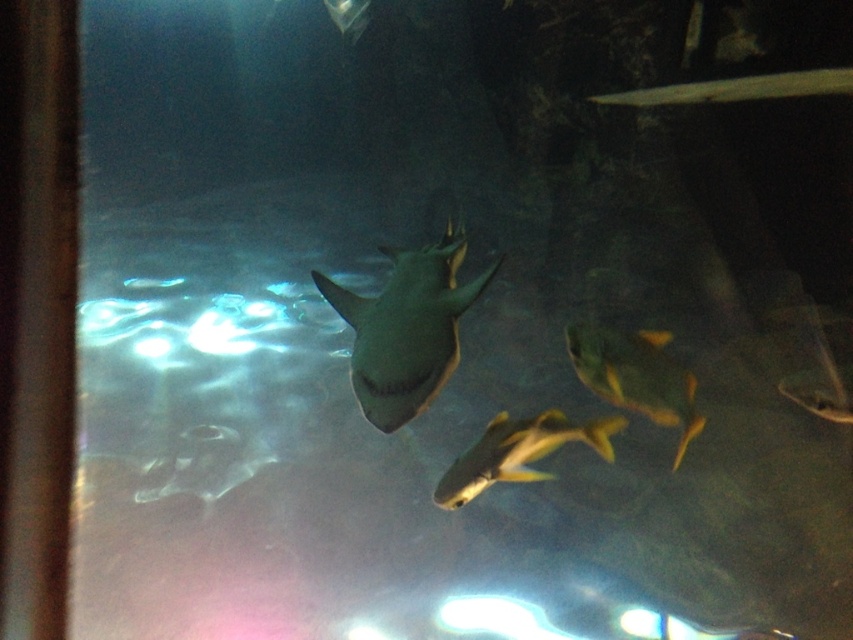
Does shiny yellow fish at center lie behind yellow matte fish at center?

Yes.

Does point (672, 426) come closer to viewer compared to point (439, 488)?

No, (672, 426) is further to viewer.

The width and height of the screenshot is (853, 640). In order to click on shiny yellow fish at center in this screenshot , I will do `click(635, 376)`.

Is point (456, 468) positioned behind point (360, 10)?

No, (456, 468) is in front of (360, 10).

Does yellow matte fish at center have a greater width compared to matte gray shark at upper center?

Indeed, yellow matte fish at center has a greater width compared to matte gray shark at upper center.

What do you see at coordinates (518, 452) in the screenshot? I see `yellow matte fish at center` at bounding box center [518, 452].

This screenshot has height=640, width=853. In order to click on yellow matte fish at center in this screenshot , I will do `click(518, 452)`.

Is shiny gray shark at center smaller than yellow matte fish at center?

Actually, shiny gray shark at center might be larger than yellow matte fish at center.

Does shiny gray shark at center have a lesser height compared to yellow matte fish at center?

Incorrect, shiny gray shark at center's height does not fall short of yellow matte fish at center's.

Is point (457, 353) positioned after point (583, 424)?

Yes, it is behind point (583, 424).

At what (x,y) coordinates should I click in order to perform the action: click on shiny gray shark at center. Please return your answer as a coordinate pair (x, y). The width and height of the screenshot is (853, 640). Looking at the image, I should click on (405, 328).